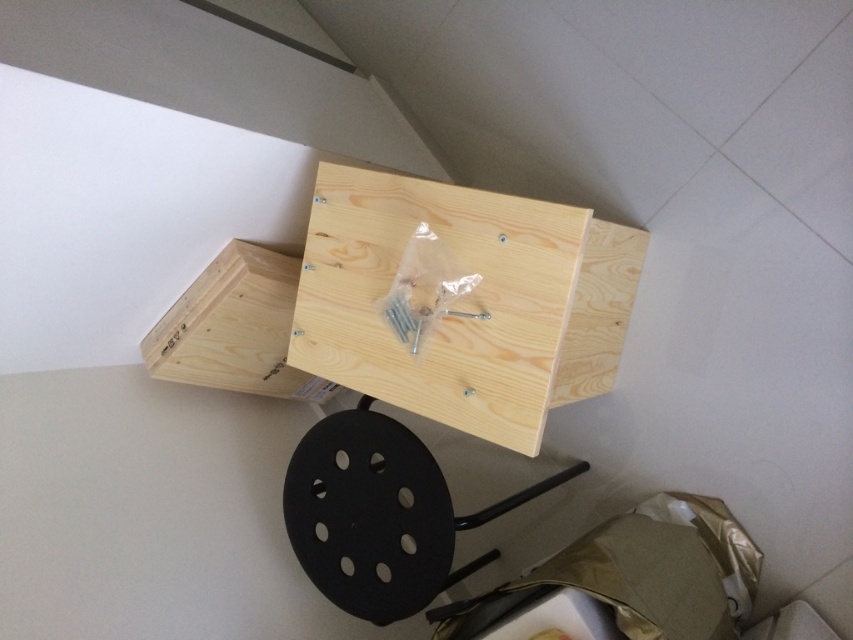
Question: Is natural wood board at center to the left of black plastic stool at lower center from the viewer's perspective?

Choices:
 (A) no
 (B) yes

Answer: (B)

Question: Does natural wood board at center come behind black plastic stool at lower center?

Choices:
 (A) yes
 (B) no

Answer: (B)

Question: Does natural wood board at center have a lesser width compared to black plastic stool at lower center?

Choices:
 (A) yes
 (B) no

Answer: (A)

Question: Which of these objects is positioned farthest from the black plastic stool at lower center?

Choices:
 (A) natural wood board at center
 (B) natural wood drawer at center

Answer: (B)

Question: Among these points, which one is nearest to the camera?

Choices:
 (A) (293, 296)
 (B) (418, 355)
 (C) (308, 577)

Answer: (B)

Question: Which of the following is the farthest from the observer?

Choices:
 (A) (372, 179)
 (B) (408, 476)

Answer: (B)